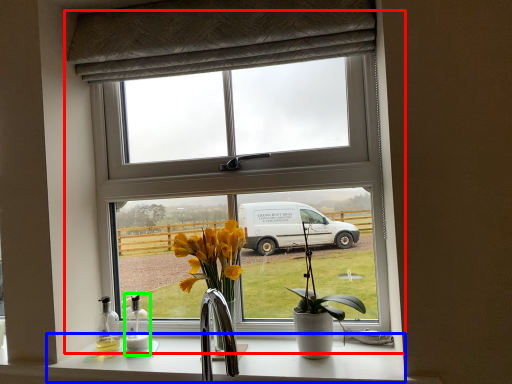
Question: Which is nearer to the window (highlighted by a red box)? counter top (highlighted by a blue box) or bottle (highlighted by a green box).

Choices:
 (A) counter top
 (B) bottle

Answer: (A)